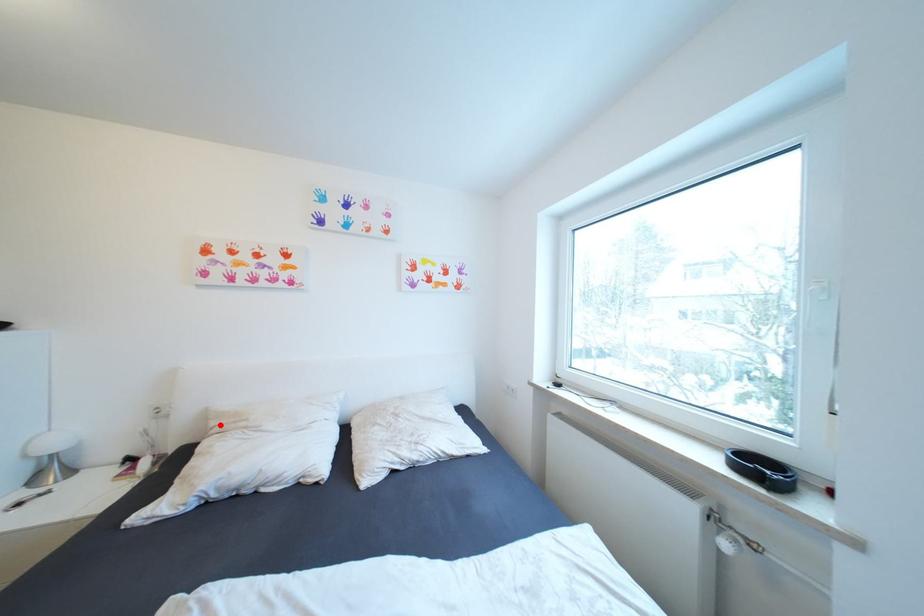
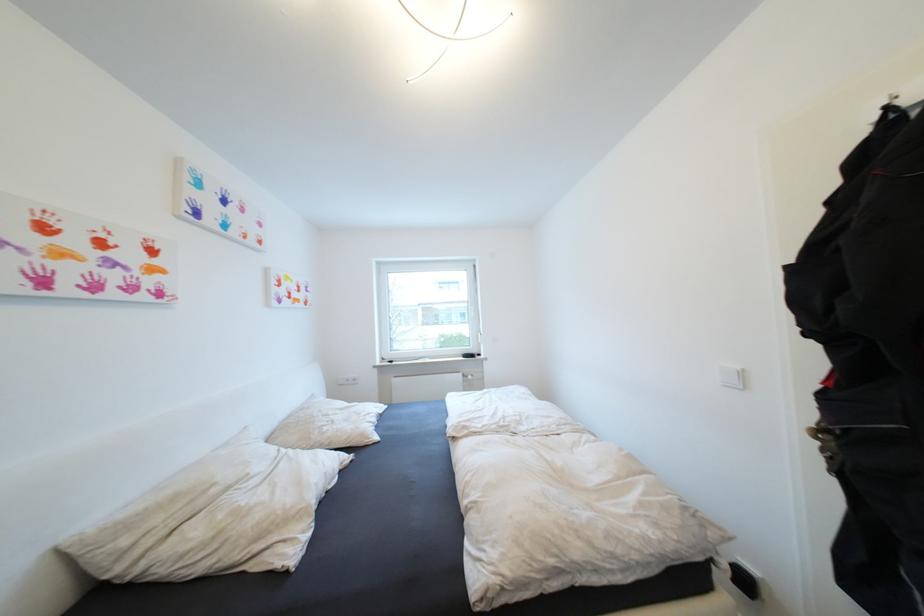
Where in the second image is the point corresponding to the highlighted location from the first image?

(131, 543)